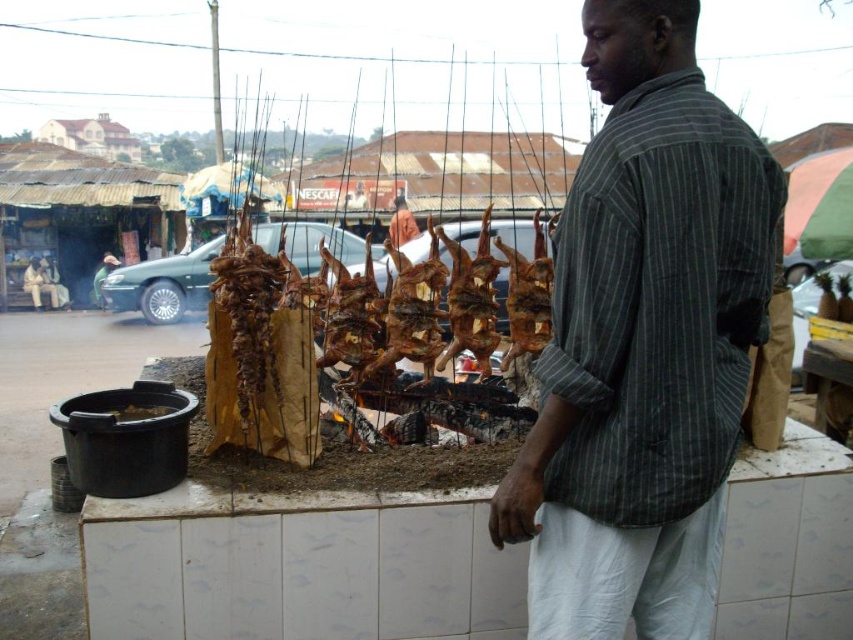
Is striped cotton shirt at center taller than brown matte pot at lower left?

Indeed, striped cotton shirt at center has a greater height compared to brown matte pot at lower left.

Which is in front, point (612, 209) or point (167, 406)?

Point (612, 209)

Find the location of a particular element. striped cotton shirt at center is located at coordinates (643, 342).

From the picture: Does striped cotton shirt at center have a greater width compared to brown crispy chicken at center?

In fact, striped cotton shirt at center might be narrower than brown crispy chicken at center.

Between striped cotton shirt at center and brown crispy chicken at center, which one has more height?

striped cotton shirt at center

I want to click on striped cotton shirt at center, so click(x=643, y=342).

The image size is (853, 640). I want to click on striped cotton shirt at center, so click(643, 342).

Does striped cotton shirt at center appear over matte brown shirt at center?

No.

Between striped cotton shirt at center and matte brown shirt at center, which one has less height?

Standing shorter between the two is matte brown shirt at center.

What do you see at coordinates (643, 342) in the screenshot? The image size is (853, 640). I see `striped cotton shirt at center` at bounding box center [643, 342].

At what (x,y) coordinates should I click in order to perform the action: click on striped cotton shirt at center. Please return your answer as a coordinate pair (x, y). This screenshot has width=853, height=640. Looking at the image, I should click on (643, 342).